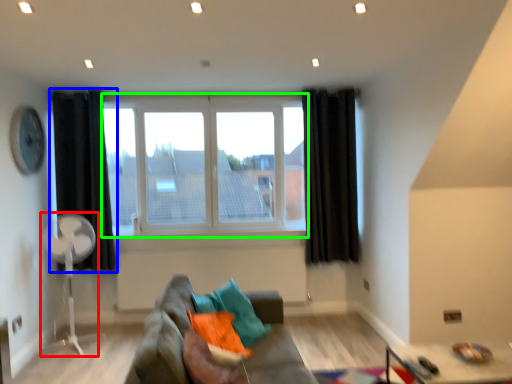
Question: Which is farther away from fan (highlighted by a red box)? curtain (highlighted by a blue box) or window (highlighted by a green box)?

Choices:
 (A) curtain
 (B) window

Answer: (B)